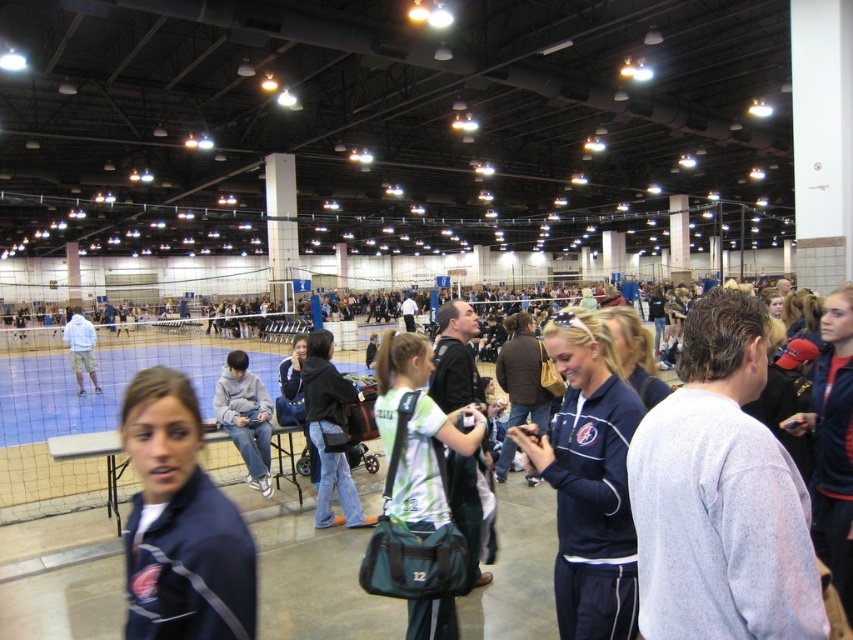
Question: Which of the following is the closest to the observer?

Choices:
 (A) (239, 412)
 (B) (660, 442)
 (C) (167, 611)

Answer: (C)

Question: Considering the relative positions of navy blue tracksuit at center and matte gray hoodie at center in the image provided, where is navy blue tracksuit at center located with respect to matte gray hoodie at center?

Choices:
 (A) right
 (B) left

Answer: (A)

Question: Which object is farther from the camera taking this photo?

Choices:
 (A) denim jacket at center
 (B) gray sweatshirt at center
 (C) navy blue tracksuit at center
 (D) green fabric backpack at center

Answer: (A)

Question: From the image, what is the correct spatial relationship of green fabric backpack at center in relation to light blue hoodie at center?

Choices:
 (A) left
 (B) right

Answer: (B)

Question: Is the position of navy blue tracksuit at center more distant than that of matte gray hoodie at center?

Choices:
 (A) no
 (B) yes

Answer: (A)

Question: Which is nearer to the gray sweatshirt at center?

Choices:
 (A) matte gray hoodie at center
 (B) green fabric backpack at center

Answer: (B)